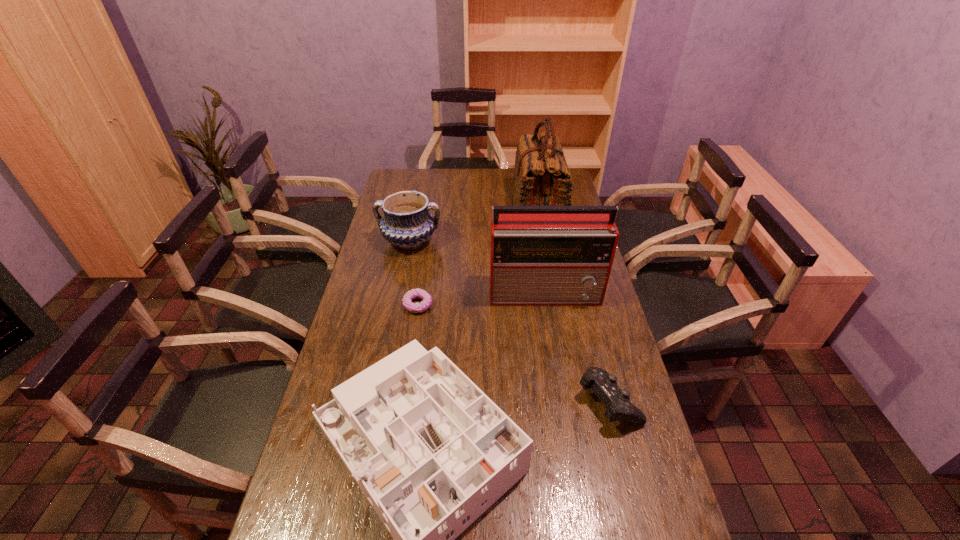
At what (x,y) coordinates should I click in order to perform the action: click on shopping bag. Please return your answer as a coordinate pair (x, y). This screenshot has height=540, width=960. Looking at the image, I should click on (541, 176).

Find the location of `radio receiver`. radio receiver is located at coordinates (539, 255).

At what (x,y) coordinates should I click in order to perform the action: click on pottery. Please return your answer as a coordinate pair (x, y). The width and height of the screenshot is (960, 540). Looking at the image, I should click on (407, 223).

Where is `control`? This screenshot has width=960, height=540. control is located at coordinates (604, 385).

I want to click on the shortest object, so click(427, 299).

Find the location of a particular element. free space located on the open handle side of the shopping bag is located at coordinates (440, 208).

Identify the location of vacant space located on the open handle side of the shopping bag. Image resolution: width=960 pixels, height=540 pixels. (491, 208).

Where is `free space located 0.380m on the open handle side of the shopping bag`? This screenshot has height=540, width=960. free space located 0.380m on the open handle side of the shopping bag is located at coordinates (426, 208).

Find the location of a particular element. The image size is (960, 540). blank space located 0.280m on the front-facing side of the radio receiver is located at coordinates (561, 375).

Locate an element on the screen. The width and height of the screenshot is (960, 540). free spot located on the right of the fourth shortest object is located at coordinates (518, 241).